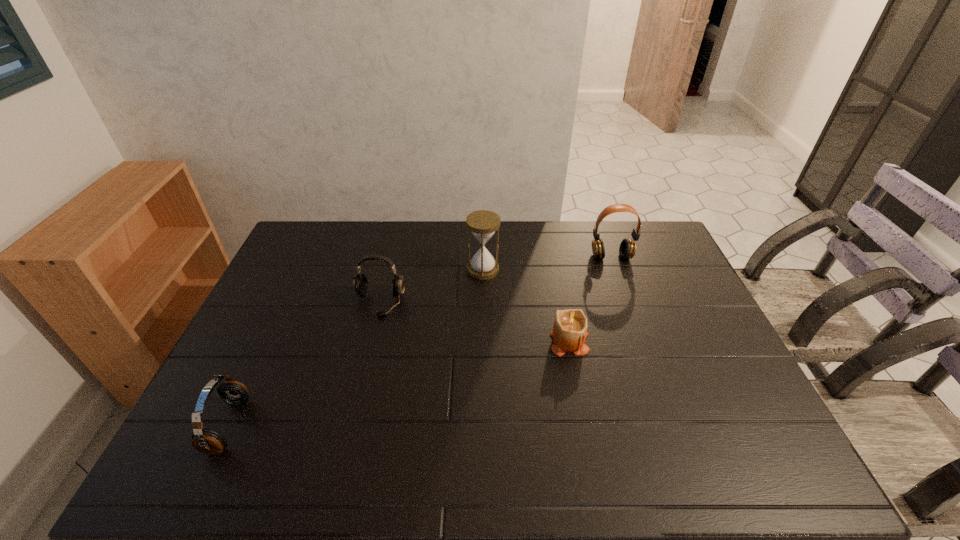
The height and width of the screenshot is (540, 960). In order to click on free space that is in between the nearest object and the fourth object from right to left in this screenshot , I will do `click(304, 364)`.

Locate an element on the screen. vacant area that lies between the farthest headset and the hourglass is located at coordinates (547, 263).

Find the location of a particular element. This screenshot has width=960, height=540. vacant area that lies between the third object from left to right and the second object from right to left is located at coordinates (526, 305).

This screenshot has width=960, height=540. I want to click on vacant region between the rightmost headset and the fourth farthest object, so click(x=590, y=299).

Identify the location of unoccupied position between the third object from right to left and the farthest headset. (547, 263).

The image size is (960, 540). Find the location of `vacant space that's between the tallest headset and the leftmost headset`. vacant space that's between the tallest headset and the leftmost headset is located at coordinates 420,341.

This screenshot has width=960, height=540. Identify the location of object that is the third closest to the fourth farthest object. (360, 282).

At what (x,y) coordinates should I click in order to perform the action: click on object that can be found as the fourth closest to the hourglass. Please return your answer as a coordinate pair (x, y). Image resolution: width=960 pixels, height=540 pixels. Looking at the image, I should click on (208, 441).

Identify which headset is the second closest to the third object from right to left. Please provide its 2D coordinates. Your answer should be formatted as a tuple, i.e. [(x, y)], where the tuple contains the x and y coordinates of a point satisfying the conditions above.

[(627, 249)]

Select which headset appears as the third closest to the second object from right to left. Please provide its 2D coordinates. Your answer should be formatted as a tuple, i.e. [(x, y)], where the tuple contains the x and y coordinates of a point satisfying the conditions above.

[(208, 441)]